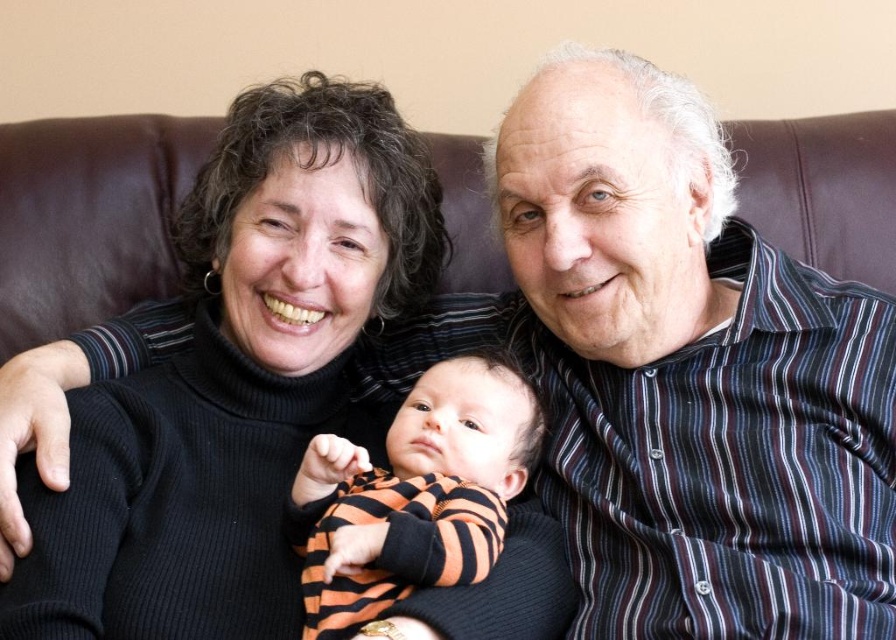
You are a photographer trying to focus on the striped shirt at upper right and the black turtleneck sweater at center. Which clothing item should you adjust your camera focus to first if you want to capture both in the same frame?

The striped shirt at upper right is located above the black turtleneck sweater at center, so you should focus on the striped shirt at upper right first to ensure both are in the frame.

You are a photographer trying to capture a group photo. You notice the striped shirt at upper right and the black turtleneck sweater at center. Which clothing item takes up more horizontal space in the photo?

The striped shirt at upper right takes up more horizontal space than the black turtleneck sweater at center because its width is larger.

You are standing in front of the couch and want to place a small gift on the point that is closer to you. Which point should you choose between point (877, 436) and point (207, 396)?

Point (877, 436) is in front of point (207, 396), so you should choose point (877, 436) to place the gift since it is closer to you.